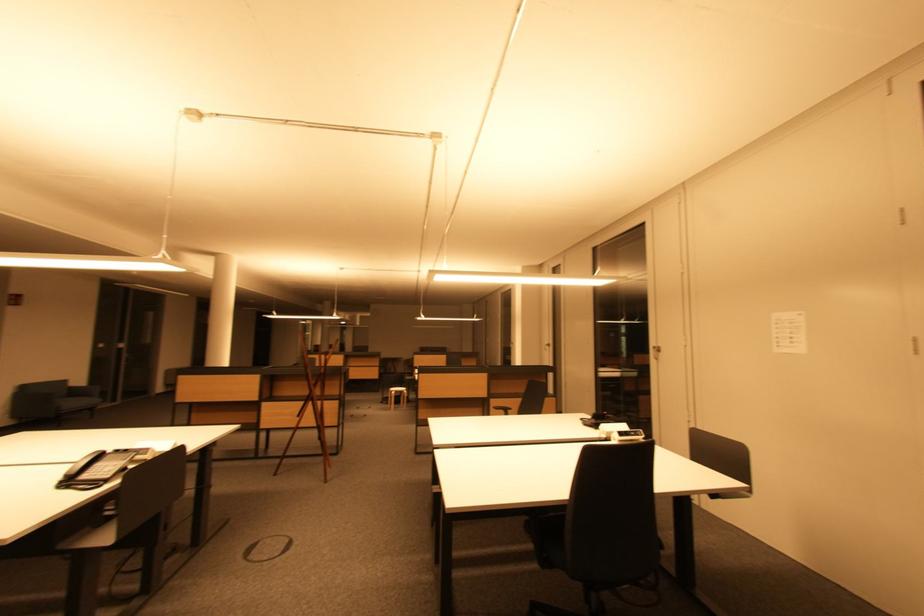
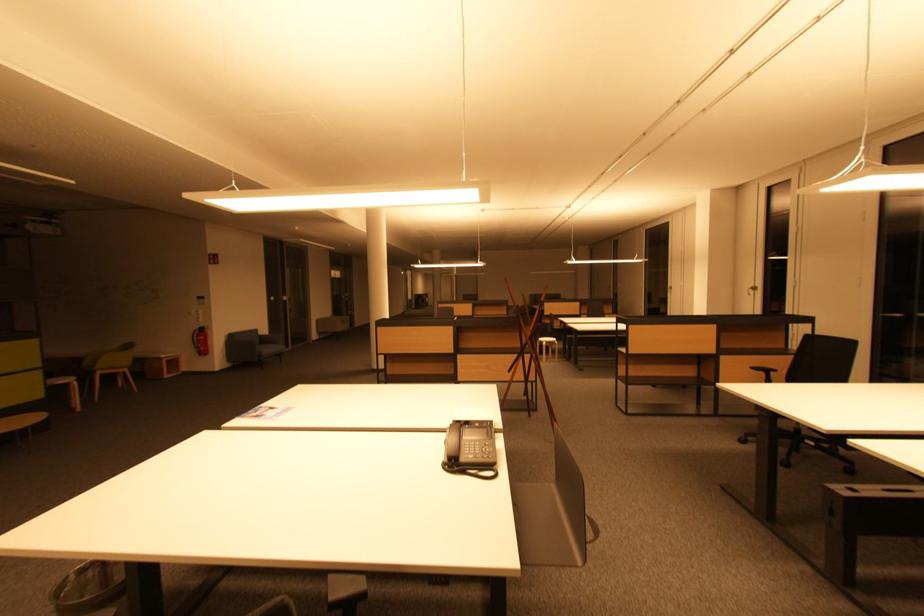
Where in the second image is the point corresponding to pixel 397 394 from the first image?

(549, 345)